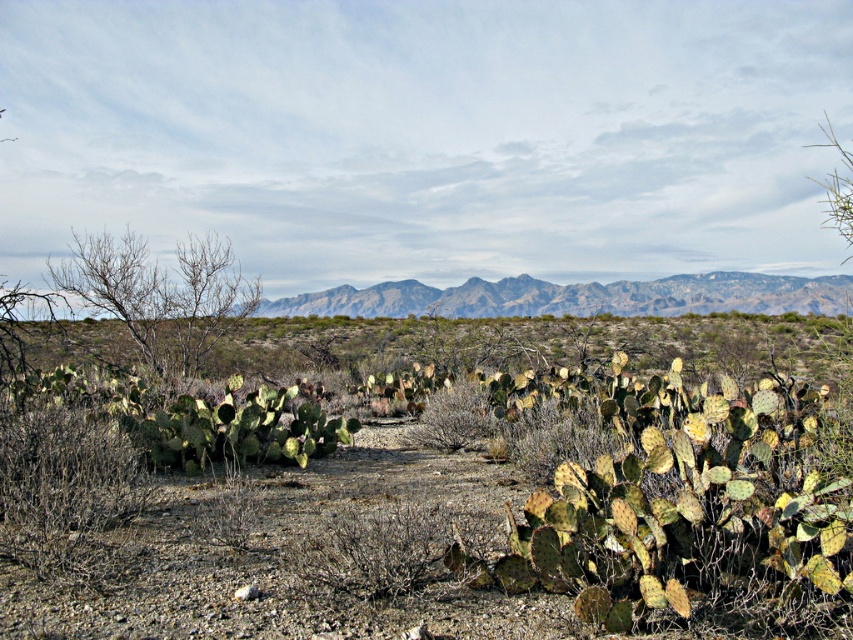
Question: Which of the following is the farthest from the observer?

Choices:
 (A) (776, 460)
 (B) (547, 289)

Answer: (B)

Question: Can you confirm if green spiny cactus at center is positioned below gray rocky mountains at center?

Choices:
 (A) yes
 (B) no

Answer: (A)

Question: Is green spiny cactus at center below gray rocky mountains at center?

Choices:
 (A) yes
 (B) no

Answer: (A)

Question: Which object is closer to the camera taking this photo?

Choices:
 (A) green spiny cactus at center
 (B) gray rocky mountains at center

Answer: (A)

Question: Can you confirm if green spiny cactus at center is positioned below gray rocky mountains at center?

Choices:
 (A) no
 (B) yes

Answer: (B)

Question: Which of the following is the farthest from the observer?

Choices:
 (A) (473, 436)
 (B) (688, 291)

Answer: (B)